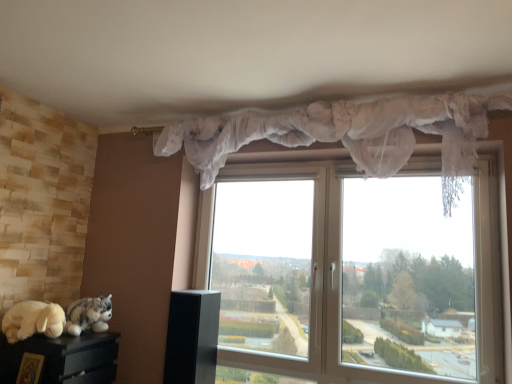
Question: Is fluffy gray plush at lower left directly adjacent to white lace curtain at upper center?

Choices:
 (A) no
 (B) yes

Answer: (A)

Question: Does fluffy gray plush at lower left have a larger size compared to white lace curtain at upper center?

Choices:
 (A) no
 (B) yes

Answer: (A)

Question: Does fluffy gray plush at lower left come in front of white lace curtain at upper center?

Choices:
 (A) yes
 (B) no

Answer: (B)

Question: Considering the relative positions of fluffy gray plush at lower left and white lace curtain at upper center in the image provided, is fluffy gray plush at lower left behind white lace curtain at upper center?

Choices:
 (A) yes
 (B) no

Answer: (A)

Question: Would you say fluffy gray plush at lower left is a long distance from white lace curtain at upper center?

Choices:
 (A) yes
 (B) no

Answer: (A)

Question: Based on their sizes in the image, would you say white lace curtain at upper center is bigger or smaller than wooden picture frame at lower left?

Choices:
 (A) big
 (B) small

Answer: (A)

Question: In the image, is white lace curtain at upper center on the left side or the right side of wooden picture frame at lower left?

Choices:
 (A) left
 (B) right

Answer: (B)

Question: Considering their positions, is white lace curtain at upper center located in front of or behind wooden picture frame at lower left?

Choices:
 (A) behind
 (B) front

Answer: (B)

Question: Considering the positions of white lace curtain at upper center and wooden picture frame at lower left in the image, is white lace curtain at upper center wider or thinner than wooden picture frame at lower left?

Choices:
 (A) wide
 (B) thin

Answer: (A)

Question: Looking at their shapes, would you say transparent plastic window at center is wider or thinner than fluffy gray plush at lower left?

Choices:
 (A) thin
 (B) wide

Answer: (B)

Question: Visually, is transparent plastic window at center positioned to the left or to the right of fluffy gray plush at lower left?

Choices:
 (A) right
 (B) left

Answer: (A)

Question: Considering the positions of point (355, 188) and point (96, 319), is point (355, 188) closer or farther from the camera than point (96, 319)?

Choices:
 (A) farther
 (B) closer

Answer: (A)

Question: From the image's perspective, is transparent plastic window at center above or below fluffy gray plush at lower left?

Choices:
 (A) above
 (B) below

Answer: (A)

Question: In terms of size, does transparent plastic window at center appear bigger or smaller than white lace curtain at upper center?

Choices:
 (A) big
 (B) small

Answer: (A)

Question: In the image, is transparent plastic window at center on the left side or the right side of white lace curtain at upper center?

Choices:
 (A) left
 (B) right

Answer: (B)